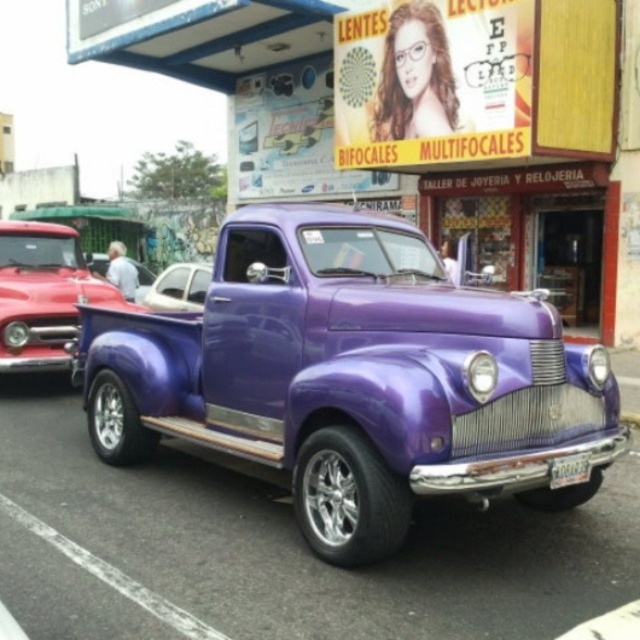
Question: Which object is farther from the camera taking this photo?

Choices:
 (A) shiny red truck at left
 (B) shiny purple truck at center
 (C) purple metallic truck at center

Answer: (C)

Question: Does shiny red truck at left have a greater width compared to purple metallic truck at center?

Choices:
 (A) no
 (B) yes

Answer: (A)

Question: Is shiny purple truck at center thinner than purple metallic truck at center?

Choices:
 (A) yes
 (B) no

Answer: (A)

Question: Is shiny purple truck at center behind shiny red truck at left?

Choices:
 (A) no
 (B) yes

Answer: (A)

Question: Which point is farther to the camera?

Choices:
 (A) satin silver car at center
 (B) purple metallic truck at center
 (C) shiny red truck at left

Answer: (B)

Question: Which point appears closest to the camera in this image?

Choices:
 (A) (145, 300)
 (B) (140, 288)
 (C) (257, 264)

Answer: (C)